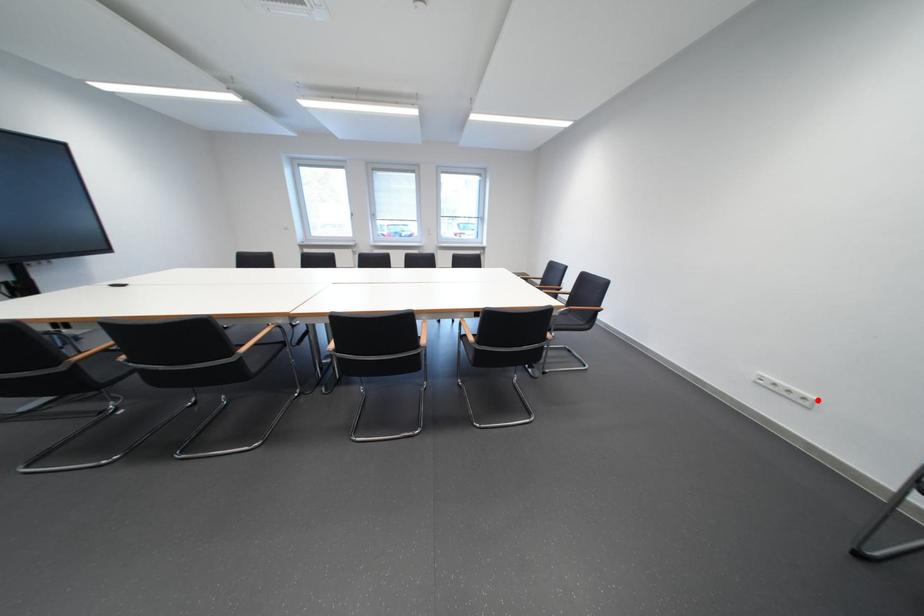
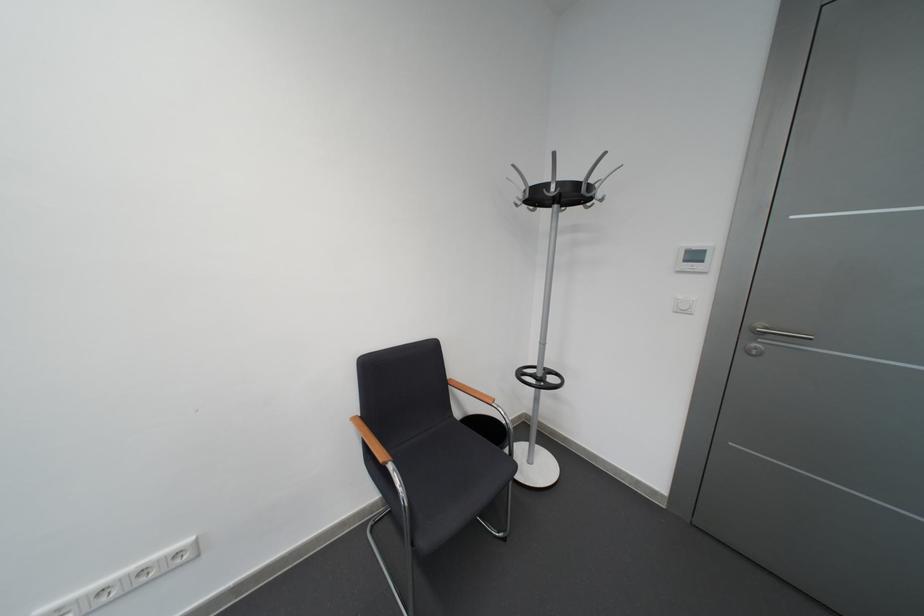
In the second image, find the point that corresponds to the highlighted location in the first image.

(190, 556)